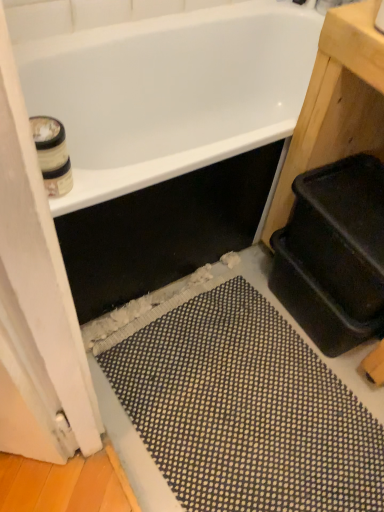
Question: Considering their positions, is white cardboard toilet paper at upper left located in front of or behind white wood screen door at left?

Choices:
 (A) behind
 (B) front

Answer: (A)

Question: Would you say white cardboard toilet paper at upper left is to the left or to the right of white wood screen door at left in the picture?

Choices:
 (A) right
 (B) left

Answer: (B)

Question: Based on their relative distances, which object is nearer to the black rubber bath mat at lower center?

Choices:
 (A) white glossy bathtub at upper center
 (B) white wood screen door at left
 (C) white cardboard toilet paper at upper left

Answer: (B)

Question: Estimate the real-world distances between objects in this image. Which object is farther from the white cardboard toilet paper at upper left?

Choices:
 (A) white wood screen door at left
 (B) black rubber bath mat at lower center
 (C) white glossy bathtub at upper center

Answer: (C)